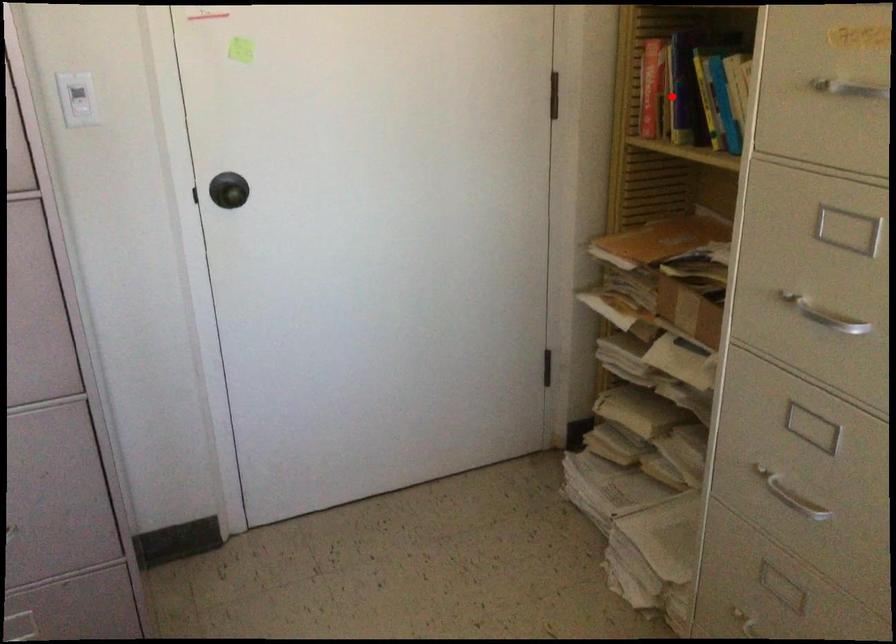
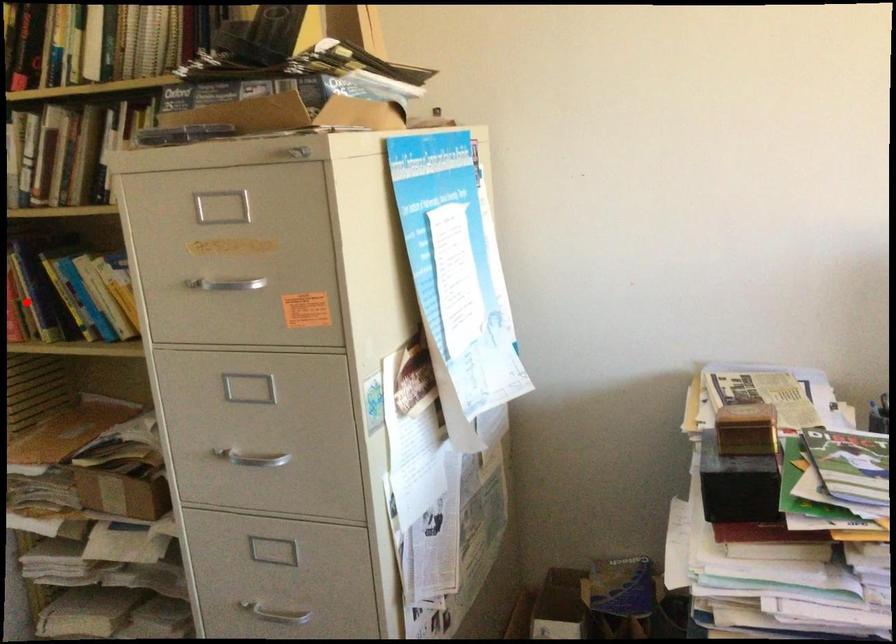
I am providing you with two images of the same scene from different viewpoints. A red point is marked on the first image and another point is marked on the second image. Is the red point in image1 aligned with the point shown in image2?

Yes